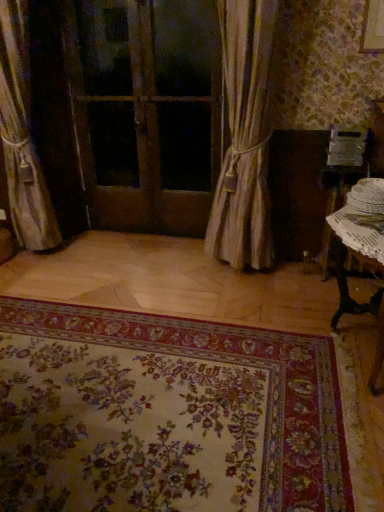
The width and height of the screenshot is (384, 512). Identify the location of wooden door at center. 145,111.

I want to click on silky beige curtain at left, which ranks as the 1th curtain in left-to-right order, so click(x=22, y=137).

At what (x,y) coordinates should I click in order to perform the action: click on white lace table at right, arranged as the 2th table when viewed from the front. Please return your answer as a coordinate pair (x, y). This screenshot has width=384, height=512. Looking at the image, I should click on (341, 183).

Locate an element on the screen. silky beige curtain at center, which is the first curtain from right to left is located at coordinates (245, 137).

Looking at their sizes, would you say silky beige curtain at center, which is the first curtain from right to left, is wider or thinner than floral carpet at lower center?

silky beige curtain at center, which is the first curtain from right to left, is thinner than floral carpet at lower center.

Is floral carpet at lower center inside silky beige curtain at center, which is the first curtain from right to left?

No, floral carpet at lower center is located outside of silky beige curtain at center, which is the first curtain from right to left.

From the image's perspective, does silky beige curtain at center, which is the first curtain from right to left, appear lower than floral carpet at lower center?

No.

In the image, is silky beige curtain at center, positioned as the 2th curtain in left-to-right order, on the left side or the right side of floral carpet at lower center?

In the image, silky beige curtain at center, positioned as the 2th curtain in left-to-right order, appears on the right side of floral carpet at lower center.

Is white lace table at right, arranged as the 2th table when viewed from the front, looking in the opposite direction of floral carpet at lower center?

white lace table at right, arranged as the 2th table when viewed from the front, is not turned away from floral carpet at lower center.

Does white lace table at right, which appears as the first table when viewed from the back, have a greater height compared to floral carpet at lower center?

Yes, white lace table at right, which appears as the first table when viewed from the back, is taller than floral carpet at lower center.

Is point (363, 168) positioned before point (233, 339)?

No.

Does white lace table at right, which appears as the first table when viewed from the back, have a lesser width compared to floral carpet at lower center?

Yes.

Between floral carpet at lower center and wooden door at center, which one has smaller size?

Smaller between the two is wooden door at center.

From the image's perspective, which one is positioned higher, floral carpet at lower center or wooden door at center?

wooden door at center is shown above in the image.

Are floral carpet at lower center and wooden door at center far apart?

Yes, floral carpet at lower center is far from wooden door at center.

Between floral carpet at lower center and silky beige curtain at center, which is the first curtain from right to left, which one appears on the left side from the viewer's perspective?

Positioned to the left is floral carpet at lower center.

Between floral carpet at lower center and silky beige curtain at center, which is the first curtain from right to left, which one has smaller size?

floral carpet at lower center is smaller.

Is floral carpet at lower center spatially inside silky beige curtain at center, positioned as the 2th curtain in left-to-right order, or outside of it?

floral carpet at lower center is spatially situated outside silky beige curtain at center, positioned as the 2th curtain in left-to-right order.

Looking at this image, can you confirm if floral carpet at lower center is thinner than silky beige curtain at center, which is the first curtain from right to left?

In fact, floral carpet at lower center might be wider than silky beige curtain at center, which is the first curtain from right to left.

Is there a large distance between silky beige curtain at left, which ranks as the 1th curtain in left-to-right order, and white wicker table at lower right, the second table from the back?

Yes, silky beige curtain at left, which ranks as the 1th curtain in left-to-right order, and white wicker table at lower right, the second table from the back, are quite far apart.

How many degrees apart are the facing directions of silky beige curtain at left, which ranks as the 1th curtain in left-to-right order, and white wicker table at lower right, the second table from the back?

94.6 degrees separate the facing orientations of silky beige curtain at left, which ranks as the 1th curtain in left-to-right order, and white wicker table at lower right, the second table from the back.

Which is correct: silky beige curtain at left, which appears as the second curtain when viewed from the right, is inside white wicker table at lower right, the second table from the back, or outside of it?

silky beige curtain at left, which appears as the second curtain when viewed from the right, lies outside white wicker table at lower right, the second table from the back.

From the image's perspective, is silky beige curtain at center, positioned as the 2th curtain in left-to-right order, beneath white lace table at right, arranged as the 2th table when viewed from the front?

No, from the image's perspective, silky beige curtain at center, positioned as the 2th curtain in left-to-right order, is not beneath white lace table at right, arranged as the 2th table when viewed from the front.

Is silky beige curtain at center, which is the first curtain from right to left, closer to the viewer compared to white lace table at right, arranged as the 2th table when viewed from the front?

Yes.

Based on their sizes in the image, would you say silky beige curtain at center, positioned as the 2th curtain in left-to-right order, is bigger or smaller than white lace table at right, arranged as the 2th table when viewed from the front?

In the image, silky beige curtain at center, positioned as the 2th curtain in left-to-right order, appears to be larger than white lace table at right, arranged as the 2th table when viewed from the front.

From the picture: Considering the relative sizes of wooden door at center and silky beige curtain at center, which is the first curtain from right to left, in the image provided, is wooden door at center thinner than silky beige curtain at center, which is the first curtain from right to left,?

Indeed, wooden door at center has a lesser width compared to silky beige curtain at center, which is the first curtain from right to left.

Is wooden door at center bigger than silky beige curtain at center, which is the first curtain from right to left?

No.

How distant is wooden door at center from silky beige curtain at center, positioned as the 2th curtain in left-to-right order?

wooden door at center and silky beige curtain at center, positioned as the 2th curtain in left-to-right order, are 32.03 inches apart from each other.

In the image, is wooden door at center positioned in front of or behind silky beige curtain at center, positioned as the 2th curtain in left-to-right order?

wooden door at center is behind silky beige curtain at center, positioned as the 2th curtain in left-to-right order.

Locate an element on the screen. This screenshot has width=384, height=512. curtain that is the 1st object above the floral carpet at lower center (from a real-world perspective) is located at coordinates (245, 137).

I want to click on the 2nd table counting from the right of the floral carpet at lower center, so click(x=341, y=183).

Considering their positions, is silky beige curtain at left, which appears as the second curtain when viewed from the right, positioned closer to wooden door at center than white lace table at right, which appears as the first table when viewed from the back?

silky beige curtain at left, which appears as the second curtain when viewed from the right, is positioned closer to the anchor wooden door at center.

Based on their spatial positions, is silky beige curtain at center, positioned as the 2th curtain in left-to-right order, or floral carpet at lower center closer to white wicker table at lower right, which appears as the first table when viewed from the front?

silky beige curtain at center, positioned as the 2th curtain in left-to-right order.

Considering their positions, is white wicker table at lower right, the second table from the back, positioned closer to white lace table at right, which appears as the first table when viewed from the back, than wooden door at center?

white wicker table at lower right, the second table from the back, lies closer to white lace table at right, which appears as the first table when viewed from the back, than the other object.

Which object lies further to the anchor point white lace table at right, which appears as the first table when viewed from the back, floral carpet at lower center or silky beige curtain at center, positioned as the 2th curtain in left-to-right order?

floral carpet at lower center is further to white lace table at right, which appears as the first table when viewed from the back.

Consider the image. Looking at the image, which one is located further to white wicker table at lower right, the second table from the back, silky beige curtain at left, which appears as the second curtain when viewed from the right, or wooden door at center?

silky beige curtain at left, which appears as the second curtain when viewed from the right, is further to white wicker table at lower right, the second table from the back.

Looking at the image, which one is located closer to white lace table at right, arranged as the 2th table when viewed from the front, wooden door at center or floral carpet at lower center?

The object closer to white lace table at right, arranged as the 2th table when viewed from the front, is floral carpet at lower center.

Estimate the real-world distances between objects in this image. Which object is closer to silky beige curtain at left, which appears as the second curtain when viewed from the right, white lace table at right, arranged as the 2th table when viewed from the front, or wooden door at center?

Among the two, wooden door at center is located nearer to silky beige curtain at left, which appears as the second curtain when viewed from the right.

Looking at the image, which one is located further to white lace table at right, arranged as the 2th table when viewed from the front, silky beige curtain at center, positioned as the 2th curtain in left-to-right order, or wooden door at center?

Based on the image, wooden door at center appears to be further to white lace table at right, arranged as the 2th table when viewed from the front.

Locate an element on the screen. curtain between silky beige curtain at left, which appears as the second curtain when viewed from the right, and white lace table at right, which appears as the first table when viewed from the back, in the horizontal direction is located at coordinates (245, 137).

Locate an element on the screen. The height and width of the screenshot is (512, 384). mat located between silky beige curtain at left, which ranks as the 1th curtain in left-to-right order, and white wicker table at lower right, the second table from the back, in the left-right direction is located at coordinates (165, 415).

Identify the location of table situated between wooden door at center and white lace table at right, which appears as the first table when viewed from the back, from left to right. (359, 240).

Where is `table situated between floral carpet at lower center and white lace table at right, which appears as the first table when viewed from the back, from left to right`? table situated between floral carpet at lower center and white lace table at right, which appears as the first table when viewed from the back, from left to right is located at coordinates (359, 240).